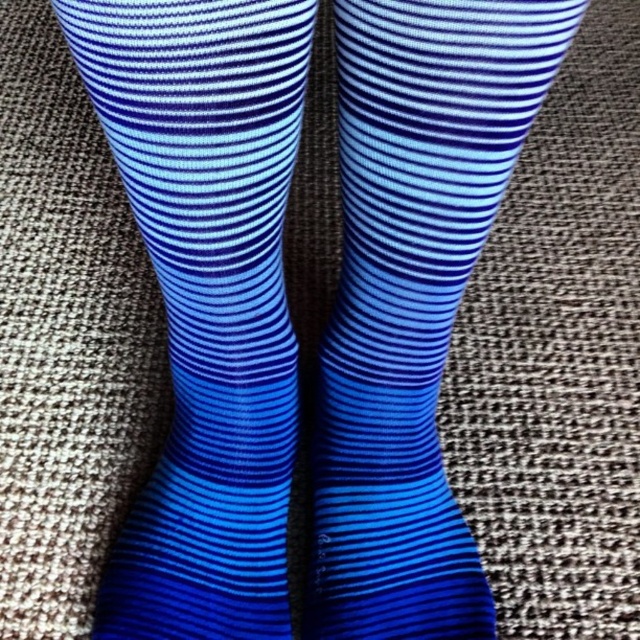
Which is above, blue striped sock at left or blue ribbed sock at center?

blue striped sock at left is higher up.

Between blue striped sock at left and blue ribbed sock at center, which one has more height?

blue ribbed sock at center is taller.

Between point (269, 435) and point (460, 198), which one is positioned behind?

The point (269, 435) is behind.

Where is `blue striped sock at left`? Image resolution: width=640 pixels, height=640 pixels. blue striped sock at left is located at coordinates (205, 298).